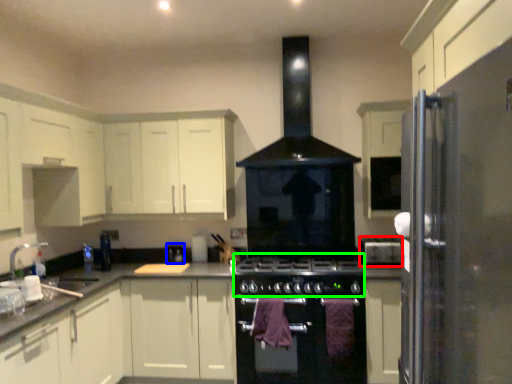
Question: Estimate the real-world distances between objects in this image. Which object is closer to appliance (highlighted by a red box), appliance (highlighted by a blue box) or gas stove (highlighted by a green box)?

Choices:
 (A) appliance
 (B) gas stove

Answer: (B)